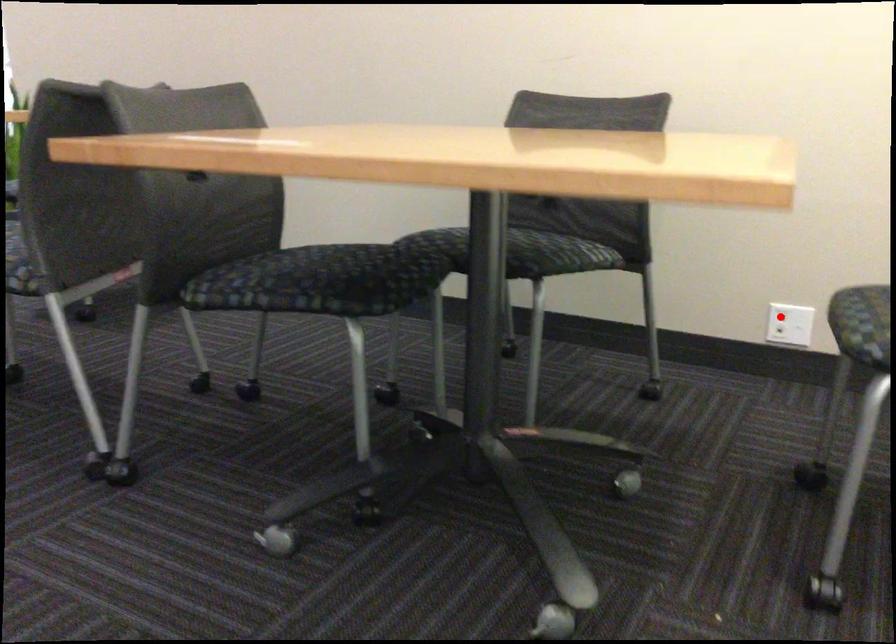
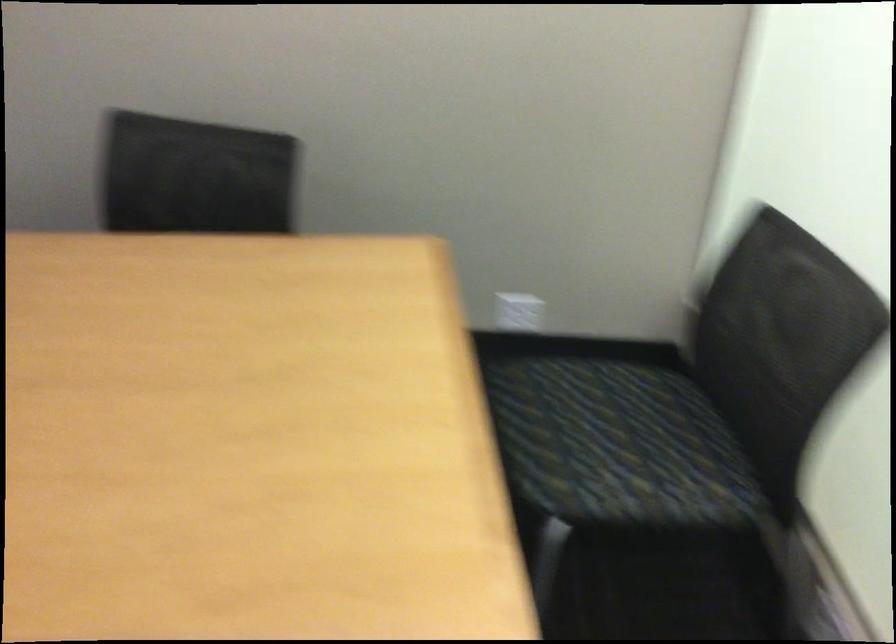
Question: I am providing you with two images of the same scene from different viewpoints. A red point is marked on the first image. At the location where the point appears in image 1, is it still visible in image 2?

Choices:
 (A) Yes
 (B) No

Answer: (B)